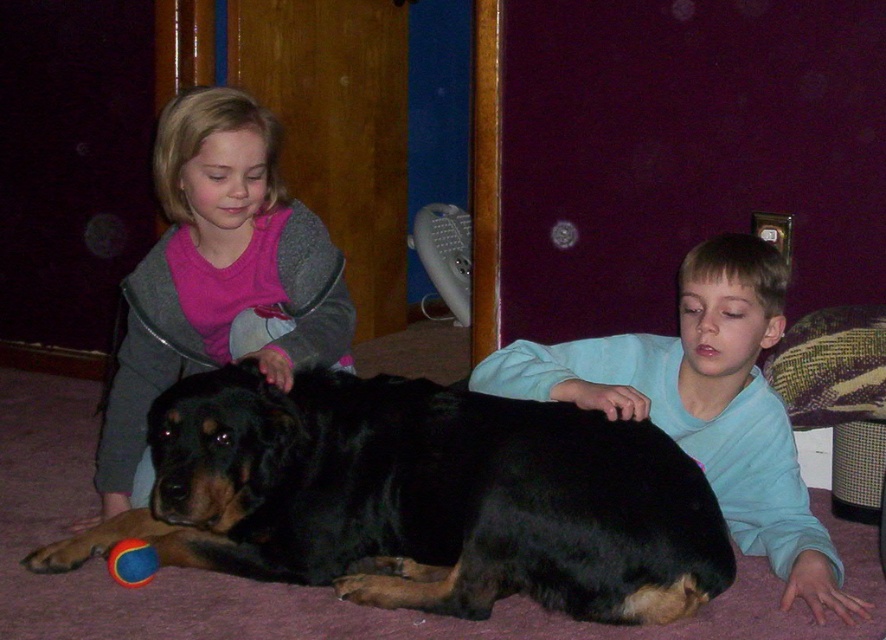
Question: Considering the relative positions of matte pink shirt at upper left and rubber ball at lower left in the image provided, where is matte pink shirt at upper left located with respect to rubber ball at lower left?

Choices:
 (A) right
 (B) left

Answer: (A)

Question: Is black glossy fur at center smaller than rubber ball at lower left?

Choices:
 (A) no
 (B) yes

Answer: (A)

Question: From the image, what is the correct spatial relationship of matte pink shirt at upper left in relation to smooth blue shirt at lower right?

Choices:
 (A) above
 (B) below

Answer: (A)

Question: Which point is farther to the camera?

Choices:
 (A) black glossy fur at center
 (B) matte pink shirt at upper left
 (C) smooth blue shirt at lower right

Answer: (B)

Question: Among these points, which one is nearest to the camera?

Choices:
 (A) (137, 577)
 (B) (261, 381)
 (C) (192, 92)
 (D) (771, 264)

Answer: (B)

Question: Estimate the real-world distances between objects in this image. Which object is farther from the matte pink shirt at upper left?

Choices:
 (A) black glossy fur at center
 (B) rubber ball at lower left

Answer: (B)